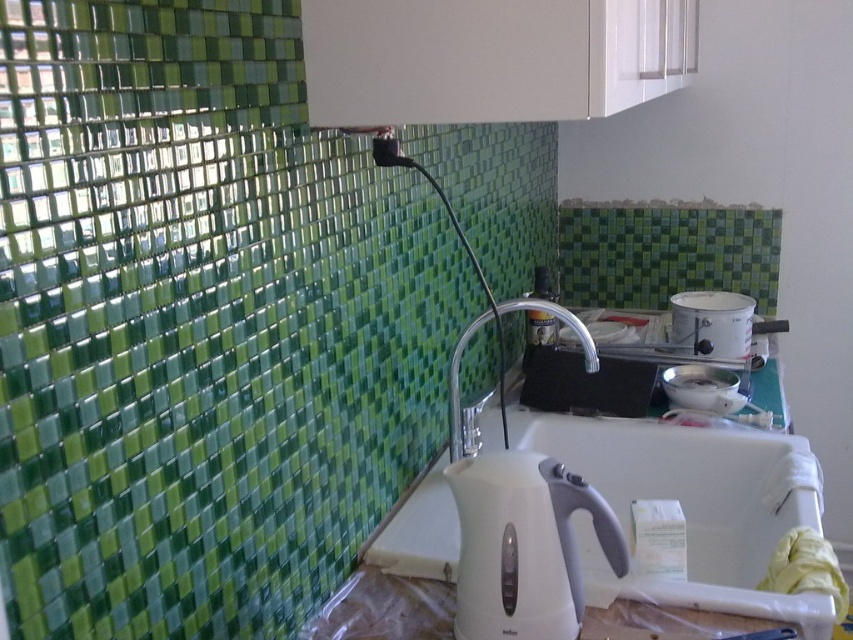
Between white plastic kettle at center and clear metallic faucet at center, which one has less height?

white plastic kettle at center is shorter.

Describe the element at coordinates (524, 545) in the screenshot. Image resolution: width=853 pixels, height=640 pixels. I see `white plastic kettle at center` at that location.

Image resolution: width=853 pixels, height=640 pixels. Find the location of `white plastic kettle at center`. white plastic kettle at center is located at coordinates (524, 545).

Does green mosaic tile at upper left have a lesser width compared to white plastic kettle at center?

No, green mosaic tile at upper left is not thinner than white plastic kettle at center.

Locate an element on the screen. The height and width of the screenshot is (640, 853). green mosaic tile at upper left is located at coordinates (200, 324).

Which is more to the left, green mosaic tile at upper left or white glossy pot at upper right?

Positioned to the left is green mosaic tile at upper left.

Who is more distant from viewer, [181,220] or [728,332]?

The point [728,332] is more distant.

The width and height of the screenshot is (853, 640). What are the coordinates of `green mosaic tile at upper left` in the screenshot? It's located at (200, 324).